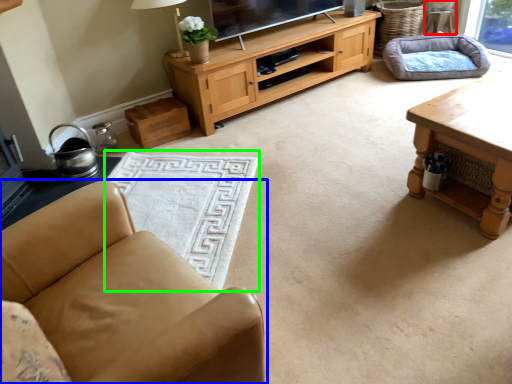
Question: Estimate the real-world distances between objects in this image. Which object is closer to armchair (highlighted by a red box), chair (highlighted by a blue box) or flat (highlighted by a green box)?

Choices:
 (A) chair
 (B) flat

Answer: (B)